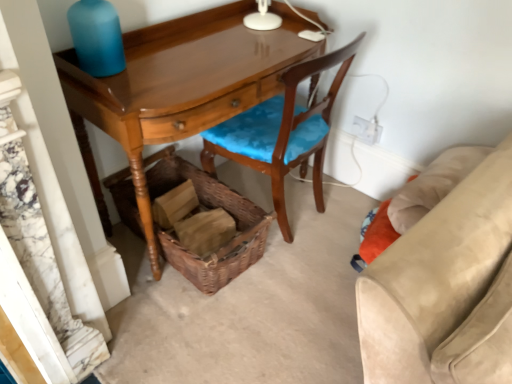
I want to click on wooden chair with blue cushion at center, so click(x=282, y=132).

In order to face white plastic power outlet at upper right, should I rotate leftwards or rightwards?

A 14.429 degree turn to the right will do.

Describe the element at coordinates (367, 130) in the screenshot. I see `white plastic power outlet at upper right` at that location.

Where is `woven brown picnic basket at lower center`? This screenshot has height=384, width=512. woven brown picnic basket at lower center is located at coordinates (207, 208).

Find the location of a particular element. The width and height of the screenshot is (512, 384). glossy wood desk at center is located at coordinates (179, 87).

Considering the sizes of objects wooden chair with blue cushion at center and white plastic power outlet at upper right in the image provided, who is bigger, wooden chair with blue cushion at center or white plastic power outlet at upper right?

wooden chair with blue cushion at center.

Consider the image. Does wooden chair with blue cushion at center touch white plastic power outlet at upper right?

No, wooden chair with blue cushion at center is not in contact with white plastic power outlet at upper right.

Looking at this image, from the image's perspective, is wooden chair with blue cushion at center located above or below white plastic power outlet at upper right?

Clearly, from the image's perspective, wooden chair with blue cushion at center is below white plastic power outlet at upper right.

Does point (320, 208) come behind point (377, 134)?

Yes, it is.

Which object is thinner, woven brown picnic basket at lower center or suede beige couch at lower right?

suede beige couch at lower right.

Is woven brown picnic basket at lower center positioned with its back to suede beige couch at lower right?

That's not correct — woven brown picnic basket at lower center is not looking away from suede beige couch at lower right.

Considering the sizes of objects woven brown picnic basket at lower center and suede beige couch at lower right in the image provided, who is shorter, woven brown picnic basket at lower center or suede beige couch at lower right?

woven brown picnic basket at lower center is shorter.

Is woven brown picnic basket at lower center positioned beyond the bounds of suede beige couch at lower right?

Yes, woven brown picnic basket at lower center is located beyond the bounds of suede beige couch at lower right.

Considering the sizes of objects wooden chair with blue cushion at center and suede beige couch at lower right in the image provided, who is taller, wooden chair with blue cushion at center or suede beige couch at lower right?

Standing taller between the two is wooden chair with blue cushion at center.

Which is nearer, (241, 160) or (403, 367)?

The point (403, 367) is more forward.

Is wooden chair with blue cushion at center facing away from suede beige couch at lower right?

Absolutely, wooden chair with blue cushion at center is directed away from suede beige couch at lower right.

Is wooden chair with blue cushion at center not close to suede beige couch at lower right?

No, wooden chair with blue cushion at center is not far from suede beige couch at lower right.

Which object is closer to the camera taking this photo, white plastic power outlet at upper right or suede beige couch at lower right?

suede beige couch at lower right is in front.

Is white plastic power outlet at upper right at the right side of suede beige couch at lower right?

Incorrect, white plastic power outlet at upper right is not on the right side of suede beige couch at lower right.

Is white plastic power outlet at upper right thinner than suede beige couch at lower right?

Indeed, white plastic power outlet at upper right has a lesser width compared to suede beige couch at lower right.

Which object is further away from the camera taking this photo, wooden chair with blue cushion at center or blue matte bottle at upper left?

wooden chair with blue cushion at center is further from the camera.

Which is more to the left, wooden chair with blue cushion at center or blue matte bottle at upper left?

Positioned to the left is blue matte bottle at upper left.

Considering the positions of point (287, 88) and point (117, 33), is point (287, 88) closer or farther from the camera than point (117, 33)?

Point (287, 88) is farther from the camera than point (117, 33).

From a real-world perspective, is wooden chair with blue cushion at center located higher than blue matte bottle at upper left?

Actually, wooden chair with blue cushion at center is physically below blue matte bottle at upper left in the real world.

You are a GUI agent. You are given a task and a screenshot of the screen. Output one action in this format:
    pyautogui.click(x=<x>, y=<y>)
    Task: Click on the desk lying on the right of woven brown picnic basket at lower center
    The height and width of the screenshot is (384, 512).
    Given the screenshot: What is the action you would take?
    pyautogui.click(x=179, y=87)

In the scene shown: Is glossy wood desk at center to the left or to the right of woven brown picnic basket at lower center in the image?

glossy wood desk at center is to the right of woven brown picnic basket at lower center.

Looking at this image, is glossy wood desk at center wider or thinner than woven brown picnic basket at lower center?

glossy wood desk at center is thinner than woven brown picnic basket at lower center.

Does wooden chair with blue cushion at center contain woven brown picnic basket at lower center?

Definitely not — woven brown picnic basket at lower center is not inside wooden chair with blue cushion at center.

From a real-world perspective, is wooden chair with blue cushion at center located beneath woven brown picnic basket at lower center?

No, from a real-world perspective, wooden chair with blue cushion at center is not beneath woven brown picnic basket at lower center.

Relative to woven brown picnic basket at lower center, is wooden chair with blue cushion at center in front or behind?

Visually, wooden chair with blue cushion at center is located in front of woven brown picnic basket at lower center.

How much distance is there between wooden chair with blue cushion at center and woven brown picnic basket at lower center?

The distance of wooden chair with blue cushion at center from woven brown picnic basket at lower center is 12.38 inches.

I want to click on chair to the left of white plastic power outlet at upper right, so click(282, 132).

Image resolution: width=512 pixels, height=384 pixels. I want to click on picnic basket that appears below the suede beige couch at lower right (from a real-world perspective), so click(x=207, y=208).

Which object lies further to the anchor point white plastic power outlet at upper right, woven brown picnic basket at lower center or blue matte bottle at upper left?

blue matte bottle at upper left is further to white plastic power outlet at upper right.

Estimate the real-world distances between objects in this image. Which object is further from wooden chair with blue cushion at center, suede beige couch at lower right or woven brown picnic basket at lower center?

suede beige couch at lower right is further to wooden chair with blue cushion at center.

Considering their positions, is glossy wood desk at center positioned closer to blue matte bottle at upper left than white plastic power outlet at upper right?

Among the two, glossy wood desk at center is located nearer to blue matte bottle at upper left.

Estimate the real-world distances between objects in this image. Which object is closer to suede beige couch at lower right, white plastic power outlet at upper right or glossy wood desk at center?

Among the two, glossy wood desk at center is located nearer to suede beige couch at lower right.

Estimate the real-world distances between objects in this image. Which object is closer to suede beige couch at lower right, woven brown picnic basket at lower center or wooden chair with blue cushion at center?

wooden chair with blue cushion at center lies closer to suede beige couch at lower right than the other object.

Looking at the image, which one is located closer to blue matte bottle at upper left, woven brown picnic basket at lower center or white plastic power outlet at upper right?

Based on the image, woven brown picnic basket at lower center appears to be nearer to blue matte bottle at upper left.

Considering their positions, is blue matte bottle at upper left positioned closer to white plastic power outlet at upper right than woven brown picnic basket at lower center?

woven brown picnic basket at lower center is positioned closer to the anchor white plastic power outlet at upper right.

When comparing their distances from white plastic power outlet at upper right, does blue matte bottle at upper left or wooden chair with blue cushion at center seem further?

blue matte bottle at upper left lies further to white plastic power outlet at upper right than the other object.

Where is `studio couch between glossy wood desk at center and white plastic power outlet at upper right along the z-axis`? The height and width of the screenshot is (384, 512). studio couch between glossy wood desk at center and white plastic power outlet at upper right along the z-axis is located at coordinates (445, 289).

At what (x,y) coordinates should I click in order to perform the action: click on desk located between blue matte bottle at upper left and suede beige couch at lower right in the left-right direction. Please return your answer as a coordinate pair (x, y). Looking at the image, I should click on (179, 87).

Find the location of `chair between glossy wood desk at center and white plastic power outlet at upper right in the front-back direction`. chair between glossy wood desk at center and white plastic power outlet at upper right in the front-back direction is located at coordinates (282, 132).

This screenshot has width=512, height=384. I want to click on desk situated between blue matte bottle at upper left and white plastic power outlet at upper right from left to right, so click(x=179, y=87).